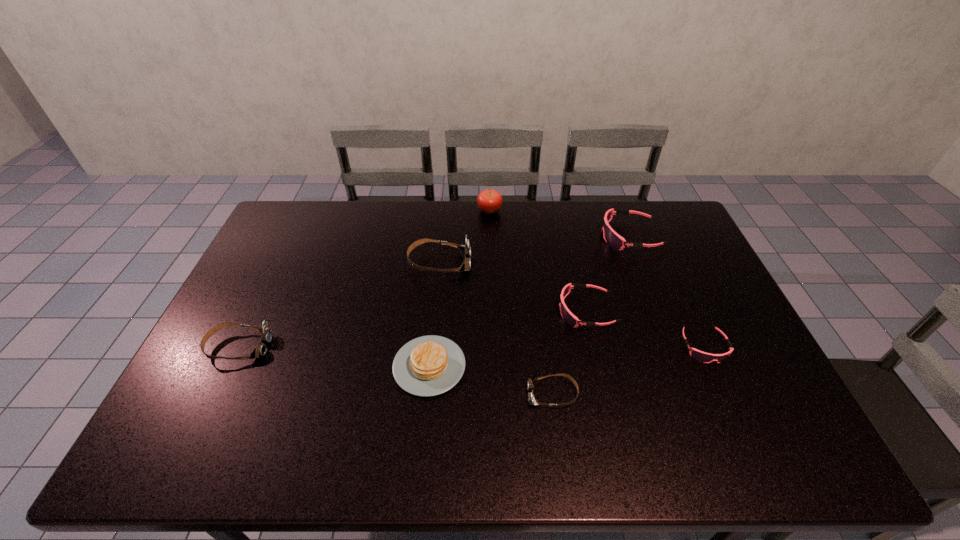
Locate an element on the screen. Image resolution: width=960 pixels, height=540 pixels. empty location between the smallest pink goggles and the leftmost pink goggles is located at coordinates (645, 329).

Identify the location of free spot between the pancake and the farthest brown goggles. (435, 314).

Locate an element on the screen. This screenshot has width=960, height=540. vacant space in between the second farthest brown goggles and the biggest pink goggles is located at coordinates (434, 292).

I want to click on free spot between the second brown goggles from left to right and the leftmost pink goggles, so click(x=513, y=287).

This screenshot has height=540, width=960. I want to click on free area in between the second smallest brown goggles and the biggest pink goggles, so click(x=434, y=292).

Image resolution: width=960 pixels, height=540 pixels. Identify the location of object that stands as the fifth closest to the tallest object. click(x=531, y=382).

Locate which object ranks in proximity to the leftmost pink goggles. Please provide its 2D coordinates. Your answer should be formatted as a tuple, i.e. [(x, y)], where the tuple contains the x and y coordinates of a point satisfying the conditions above.

[(531, 382)]

I want to click on goggles that stands as the second closest to the leftmost brown goggles, so click(531, 382).

Find the location of a particular element. goggles that is the fourth closest one to the tallest object is located at coordinates (531, 382).

Choose which pink goggles is the second nearest neighbor to the farthest pink goggles. Please provide its 2D coordinates. Your answer should be formatted as a tuple, i.e. [(x, y)], where the tuple contains the x and y coordinates of a point satisfying the conditions above.

[(701, 356)]